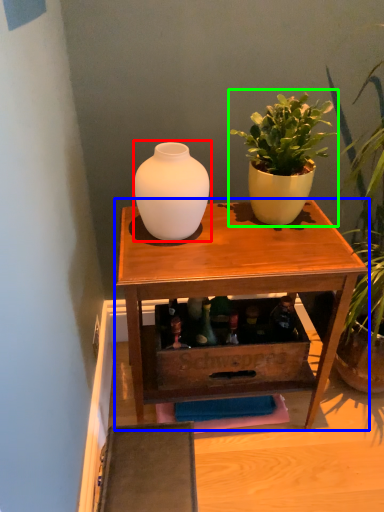
Question: Estimate the real-world distances between objects in this image. Which object is farther from vase (highlighted by a red box), table (highlighted by a blue box) or houseplant (highlighted by a green box)?

Choices:
 (A) table
 (B) houseplant

Answer: (A)